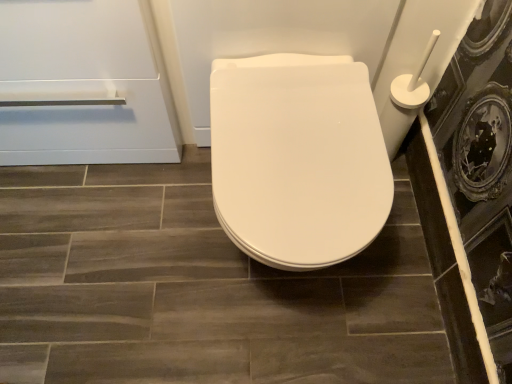
Question: Does matte ceramic tile at center have a greater height compared to white glossy toilet seat at center?

Choices:
 (A) yes
 (B) no

Answer: (B)

Question: Does matte ceramic tile at center appear on the right side of white glossy toilet seat at center?

Choices:
 (A) no
 (B) yes

Answer: (A)

Question: Can you confirm if matte ceramic tile at center is wider than white glossy toilet seat at center?

Choices:
 (A) no
 (B) yes

Answer: (B)

Question: From the image's perspective, does matte ceramic tile at center appear higher than white glossy toilet seat at center?

Choices:
 (A) no
 (B) yes

Answer: (A)

Question: Does matte ceramic tile at center come behind white glossy toilet seat at center?

Choices:
 (A) no
 (B) yes

Answer: (B)

Question: Are matte ceramic tile at center and white glossy toilet seat at center beside each other?

Choices:
 (A) yes
 (B) no

Answer: (B)

Question: Would you say white glossy toilet seat at center contains white glossy toilet seat at center?

Choices:
 (A) yes
 (B) no

Answer: (B)

Question: Is white glossy toilet seat at center to the left of white glossy toilet seat at center from the viewer's perspective?

Choices:
 (A) no
 (B) yes

Answer: (B)

Question: Is white glossy toilet seat at center shorter than white glossy toilet seat at center?

Choices:
 (A) no
 (B) yes

Answer: (B)

Question: From a real-world perspective, is white glossy toilet seat at center physically below white glossy toilet seat at center?

Choices:
 (A) yes
 (B) no

Answer: (A)

Question: Does white glossy toilet seat at center lie behind white glossy toilet seat at center?

Choices:
 (A) no
 (B) yes

Answer: (A)

Question: Does white glossy toilet seat at center have a greater width compared to white glossy toilet seat at center?

Choices:
 (A) no
 (B) yes

Answer: (B)

Question: From a real-world perspective, is matte ceramic tile at center on transparent glass screen door at right?

Choices:
 (A) no
 (B) yes

Answer: (A)